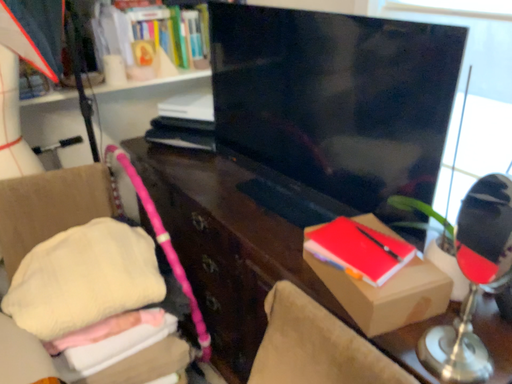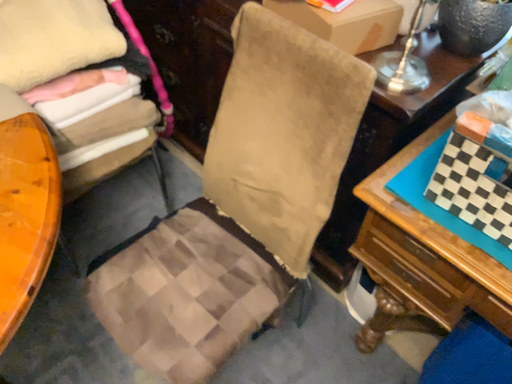
Question: Which way did the camera rotate in the video?

Choices:
 (A) rotated left
 (B) rotated right

Answer: (B)